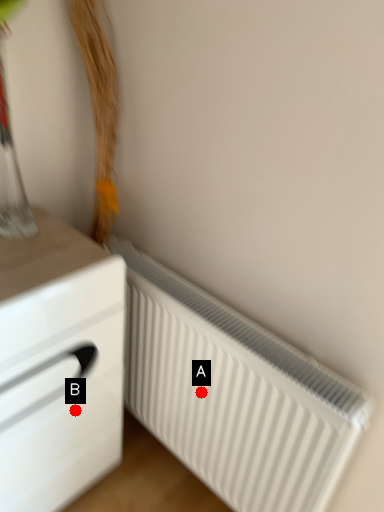
Question: Two points are circled on the image, labeled by A and B beside each circle. Which point appears closest to the camera in this image?

Choices:
 (A) A is closer
 (B) B is closer

Answer: (A)